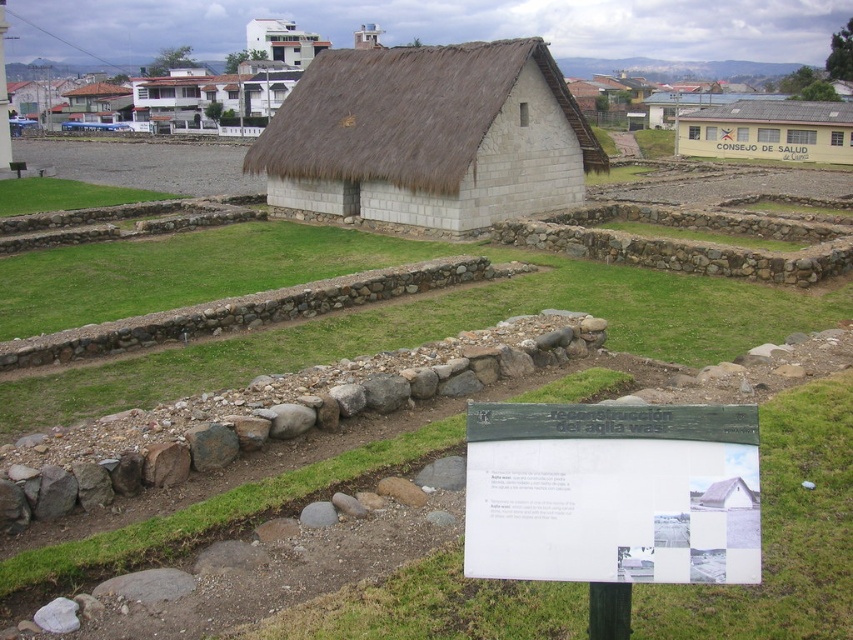
Question: Which is nearer to the green grass at lower center?

Choices:
 (A) green grass at center
 (B) yellow paper sign at center
 (C) thatched straw roof at center
 (D) green grass at upper left

Answer: (A)

Question: Is green grass at lower center further to camera compared to green grass at center?

Choices:
 (A) yes
 (B) no

Answer: (B)

Question: Among these objects, which one is farthest from the camera?

Choices:
 (A) white paper sign at center
 (B) green grass at lower center

Answer: (B)

Question: Which of the following is the farthest from the observer?

Choices:
 (A) (701, 548)
 (B) (842, 452)
 (C) (787, 106)
 (D) (737, 145)

Answer: (D)

Question: Does thatched straw roof at center lie behind yellow paper sign at center?

Choices:
 (A) no
 (B) yes

Answer: (A)

Question: From the image, what is the correct spatial relationship of thatched straw roof at center in relation to yellow painted building at upper right?

Choices:
 (A) above
 (B) below

Answer: (B)